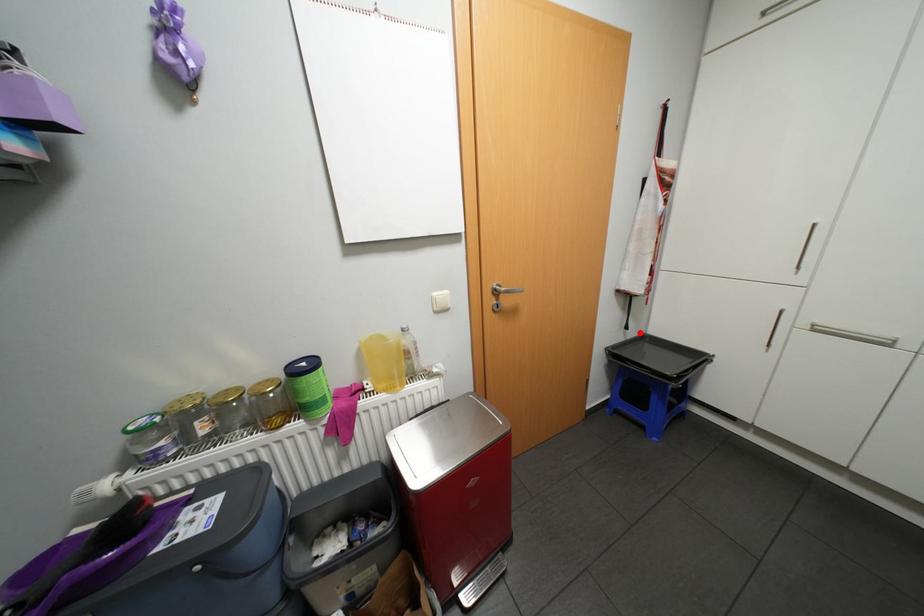
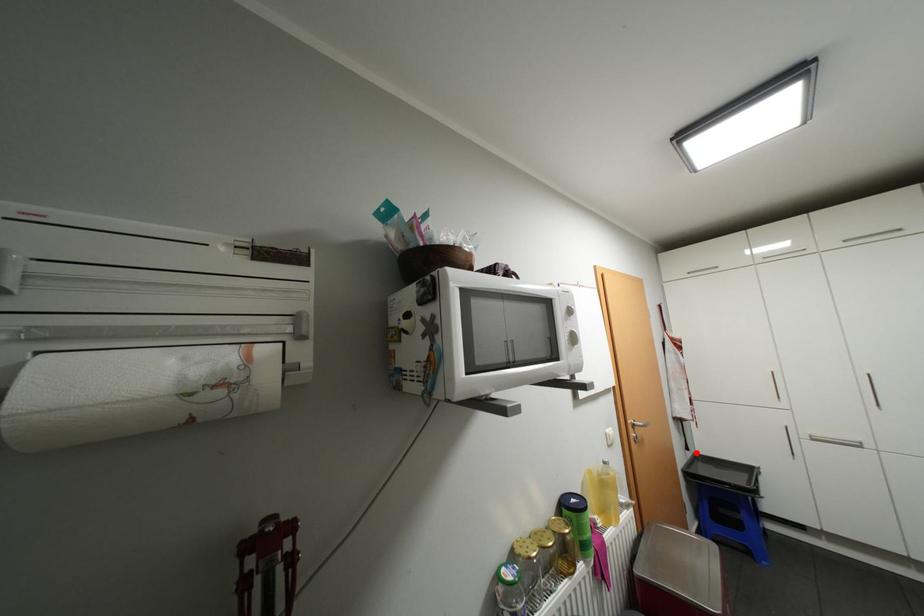
I am providing you with two images of the same scene from different viewpoints. A red point is marked on the first image and another point is marked on the second image. Are the points marked in image1 and image2 representing the same 3D position?

Yes